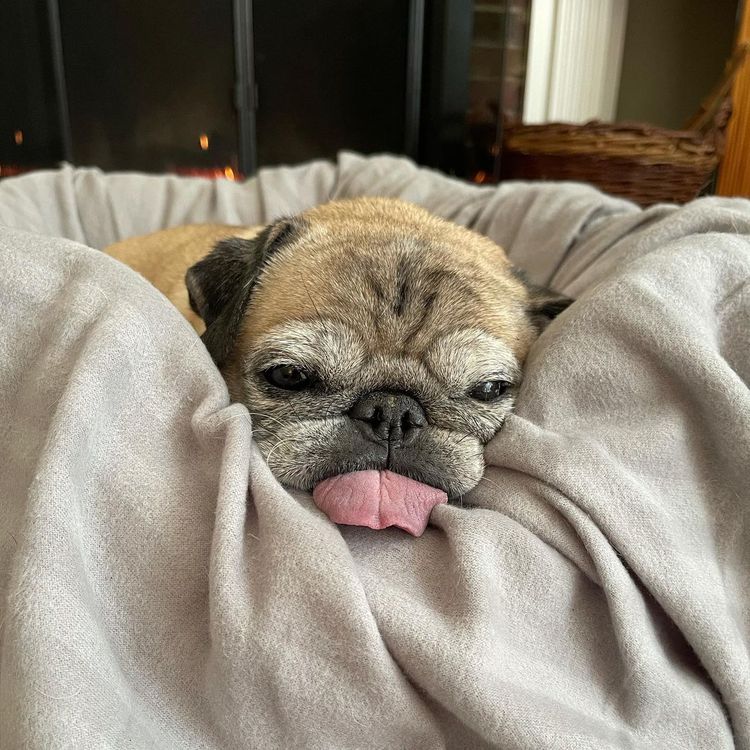
Identify the location of bottom of tan blanket under uppy. The image size is (750, 750). (69, 447), (112, 542), (224, 646), (344, 680), (644, 538), (494, 658), (634, 583).